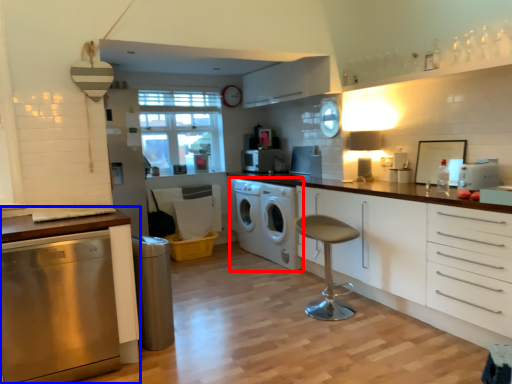
Question: Which object is closer to the camera taking this photo, washing machine (highlighted by a red box) or cabinetry (highlighted by a blue box)?

Choices:
 (A) washing machine
 (B) cabinetry

Answer: (B)